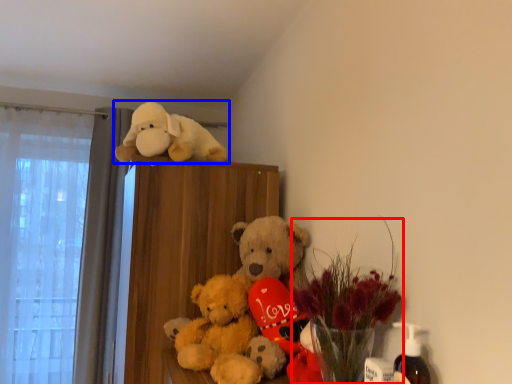
Question: Among these objects, which one is nearest to the camera, floral arrangement (highlighted by a red box) or toy (highlighted by a blue box)?

Choices:
 (A) floral arrangement
 (B) toy

Answer: (A)